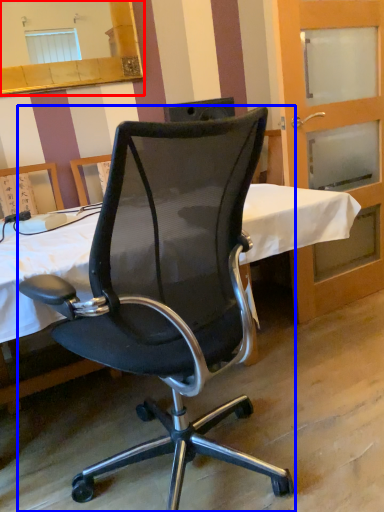
Question: Which of the following is the closest to the observer, mirror (highlighted by a red box) or chair (highlighted by a blue box)?

Choices:
 (A) mirror
 (B) chair

Answer: (B)